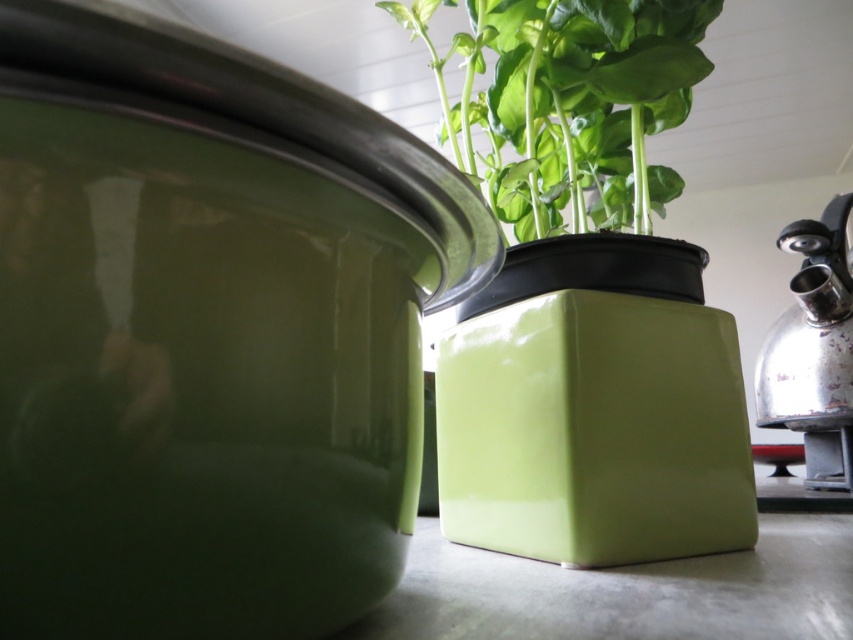
Question: Does green glossy plant at center have a lesser width compared to shiny metallic kettle at right?

Choices:
 (A) no
 (B) yes

Answer: (A)

Question: Where is green glossy plant at center located in relation to shiny metallic kettle at right in the image?

Choices:
 (A) below
 (B) above

Answer: (B)

Question: Which of the following is the farthest from the observer?

Choices:
 (A) (770, 406)
 (B) (654, 124)

Answer: (A)

Question: Observing the image, what is the correct spatial positioning of green glossy plant at center in reference to shiny metallic kettle at right?

Choices:
 (A) right
 (B) left

Answer: (B)

Question: Which point is closer to the camera taking this photo?

Choices:
 (A) (767, 419)
 (B) (630, 64)

Answer: (B)